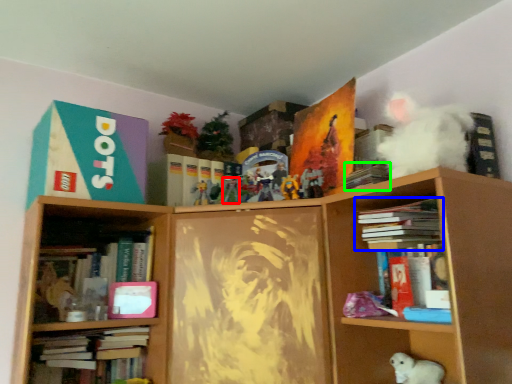
Question: Which object is positioned closest to toy (highlighted by a red box)? Select from book (highlighted by a blue box) and book (highlighted by a green box).

Choices:
 (A) book
 (B) book

Answer: (B)